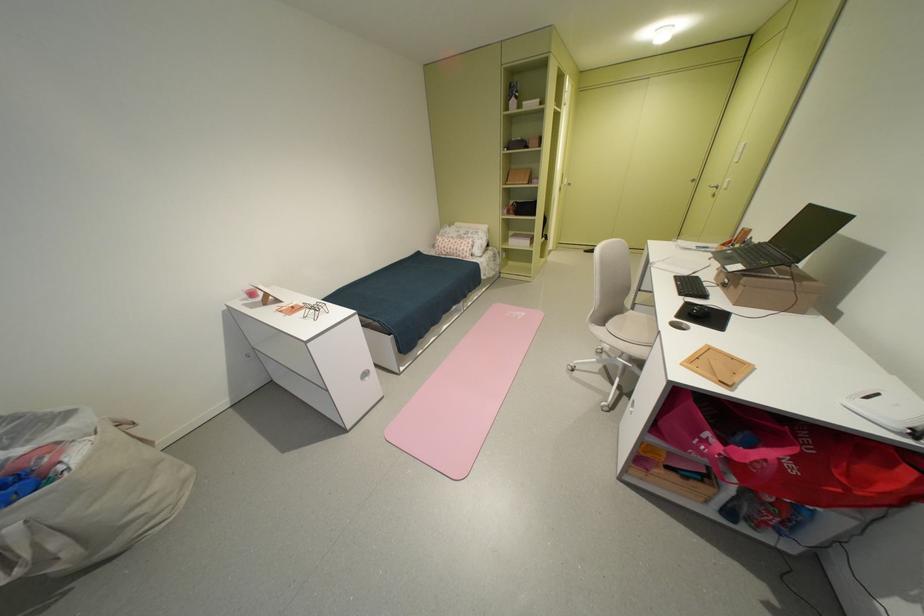
This screenshot has width=924, height=616. Find the location of `large cloth bag`. large cloth bag is located at coordinates (81, 491).